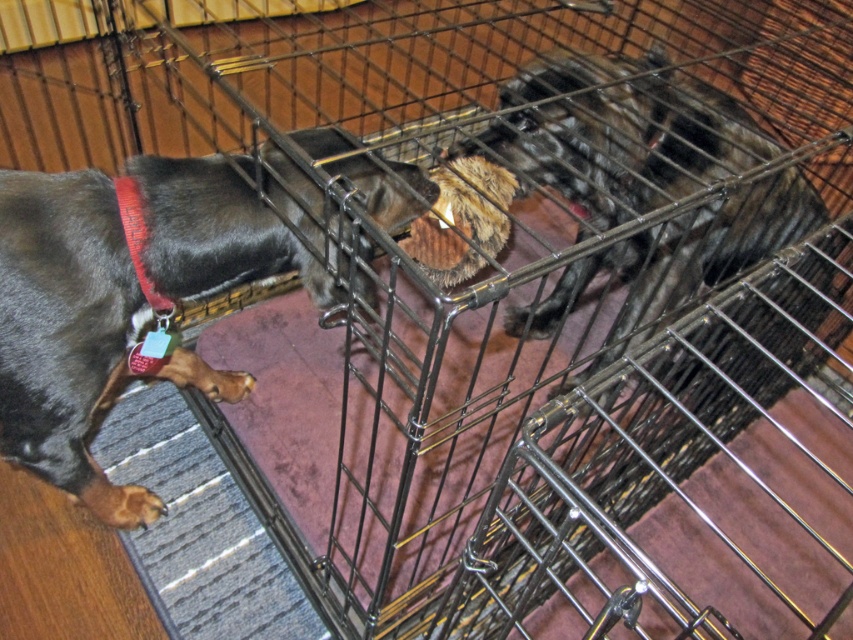
Between shiny black fur at left and red fabric collar at left, which one has more height?

shiny black fur at left

Which is in front, point (184, 368) or point (122, 208)?

Point (122, 208) is more forward.

Find the location of a particular element. The height and width of the screenshot is (640, 853). shiny black fur at left is located at coordinates (65, 332).

Does shiny black fur at left have a larger size compared to black fur dog at center?

Actually, shiny black fur at left might be smaller than black fur dog at center.

Is shiny black fur at left to the right of black fur dog at center from the viewer's perspective?

No, shiny black fur at left is not to the right of black fur dog at center.

Between point (105, 202) and point (646, 262), which one is positioned in front?

Point (105, 202)

Identify the location of shiny black fur at left. The height and width of the screenshot is (640, 853). (65, 332).

Is black fur dog at center to the left of red fabric collar at left from the viewer's perspective?

In fact, black fur dog at center is to the right of red fabric collar at left.

Can you confirm if black fur dog at center is thinner than red fabric collar at left?

No, black fur dog at center is not thinner than red fabric collar at left.

Who is more distant from viewer, [552,173] or [136,260]?

Point [552,173]

The image size is (853, 640). Identify the location of black fur dog at center. (618, 134).